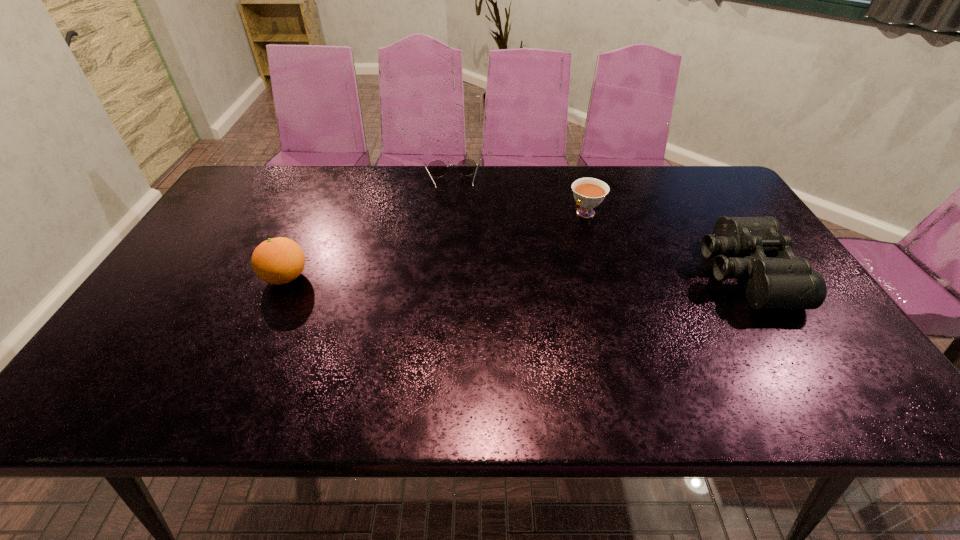
Where is `vacant area situated on the front-facing side of the farthest object`? This screenshot has height=540, width=960. vacant area situated on the front-facing side of the farthest object is located at coordinates (460, 260).

Find the location of `vacant region located 0.400m on the front-facing side of the farthest object`. vacant region located 0.400m on the front-facing side of the farthest object is located at coordinates [463, 286].

At what (x,y) coordinates should I click in order to perform the action: click on vacant space located 0.090m on the front-facing side of the farthest object. Please return your answer as a coordinate pair (x, y). This screenshot has width=960, height=540. Looking at the image, I should click on (455, 214).

Find the location of a particular element. This screenshot has width=960, height=540. teacup that is at the far edge is located at coordinates (589, 193).

The width and height of the screenshot is (960, 540). Find the location of `spectacles present at the far edge`. spectacles present at the far edge is located at coordinates (437, 168).

This screenshot has height=540, width=960. Find the location of `object that is at the right edge`. object that is at the right edge is located at coordinates (786, 281).

In the image, there is a desktop. Where is `blank space at the far edge`? This screenshot has height=540, width=960. blank space at the far edge is located at coordinates (485, 174).

Where is `vacant space at the near edge of the desktop`? vacant space at the near edge of the desktop is located at coordinates (468, 359).

In the image, there is a desktop. Where is `free space at the left edge`? The width and height of the screenshot is (960, 540). free space at the left edge is located at coordinates (231, 207).

Image resolution: width=960 pixels, height=540 pixels. In order to click on vacant space at the near right corner in this screenshot , I will do `click(826, 343)`.